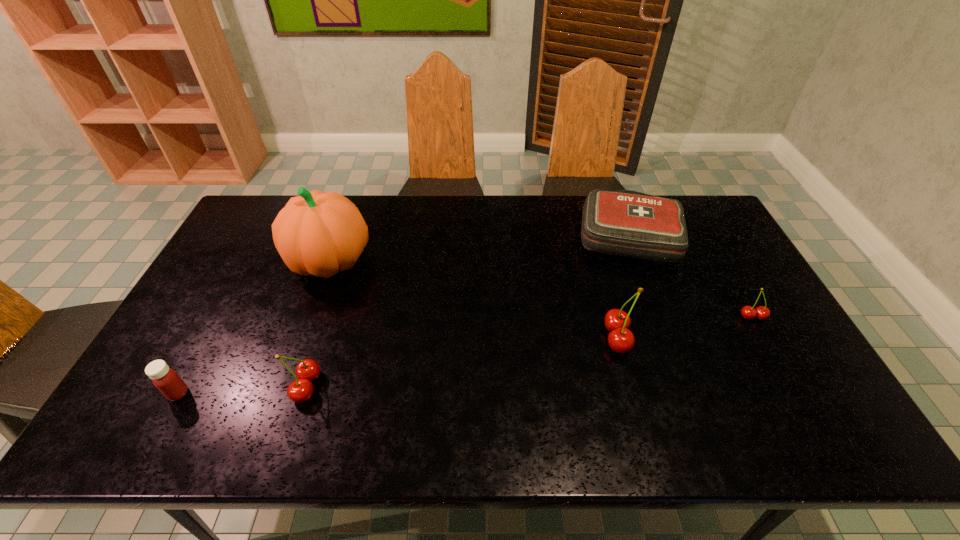
Locate an element on the screen. The width and height of the screenshot is (960, 540). vacant space situated with the stems of the second cherry from left to right pointing upwards is located at coordinates (526, 338).

Find the location of a particular element. The height and width of the screenshot is (540, 960). vacant region located with the stems of the second cherry from left to right pointing upwards is located at coordinates (560, 338).

The height and width of the screenshot is (540, 960). What are the coordinates of `vacant space located 0.240m with the stems of the shortest cherry pointing upwards` in the screenshot? It's located at (800, 400).

This screenshot has height=540, width=960. Find the location of `vacant space located on the left of the tallest object`. vacant space located on the left of the tallest object is located at coordinates (247, 261).

Locate an element on the screen. The height and width of the screenshot is (540, 960). vacant space located 0.120m on the left of the first-aid kit is located at coordinates (540, 234).

The width and height of the screenshot is (960, 540). In order to click on vacant region located on the back of the leftmost object in this screenshot , I will do `click(200, 354)`.

Locate an element on the screen. pumpkin at the far edge is located at coordinates (317, 233).

Find the location of `the first-aid kit located in the far edge section of the desktop`. the first-aid kit located in the far edge section of the desktop is located at coordinates (627, 223).

Locate an element on the screen. cherry that is at the near edge is located at coordinates (299, 391).

Identify the location of medicine present at the near edge. (166, 380).